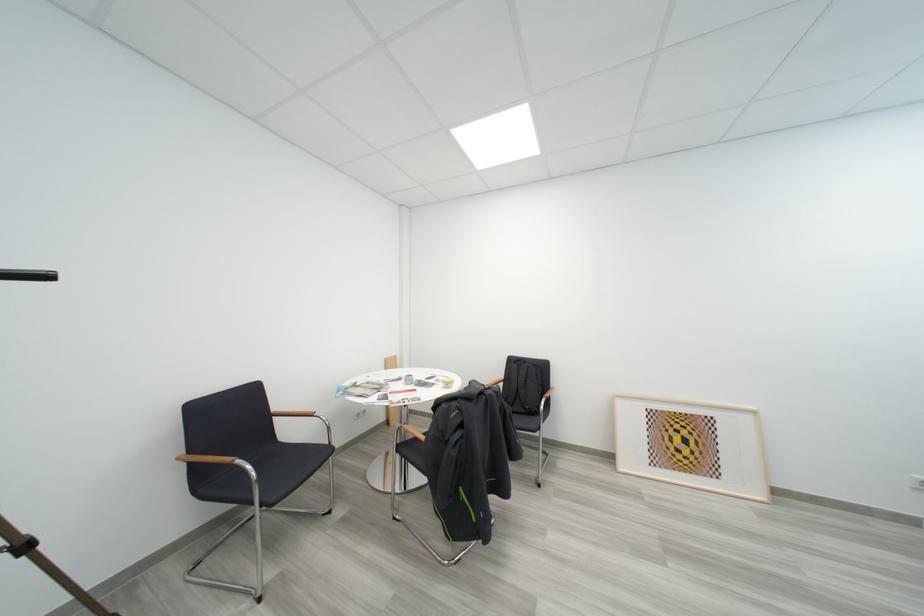
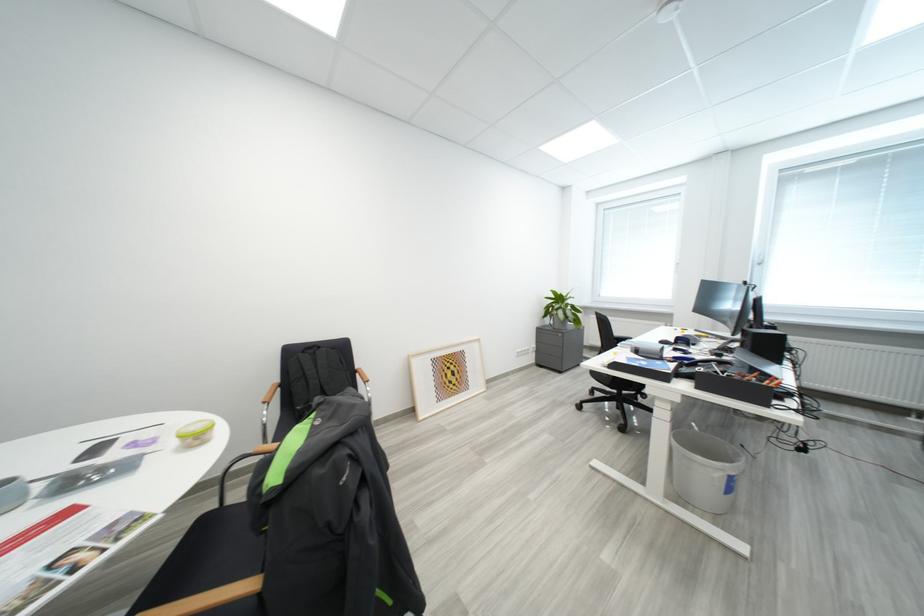
Question: The images are taken continuously from a first-person perspective. In which direction is your viewpoint rotating?

Choices:
 (A) Left
 (B) Right
 (C) Up
 (D) Down

Answer: (B)